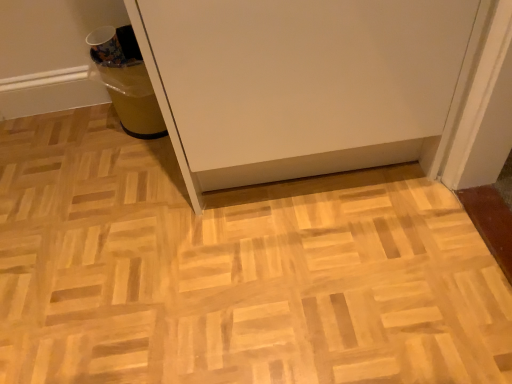
The width and height of the screenshot is (512, 384). Describe the element at coordinates (233, 271) in the screenshot. I see `natural wood parquet floor at center` at that location.

Locate an element on the screen. The image size is (512, 384). natural wood parquet floor at center is located at coordinates (233, 271).

The height and width of the screenshot is (384, 512). I want to click on natural wood parquet floor at center, so click(233, 271).